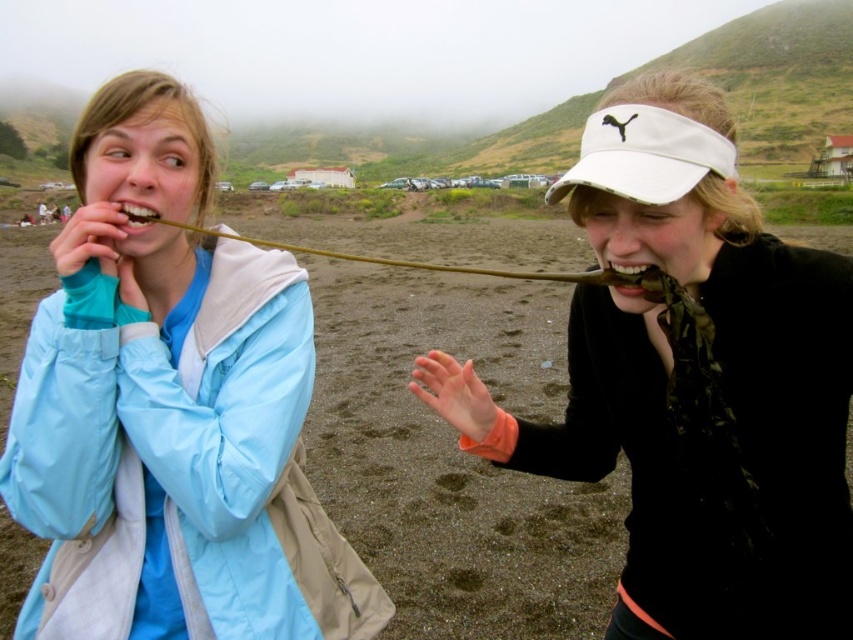
You are standing in the open area where the matte blue jacket at left and the white matte visor at center are present. If you look down from your current position, which object would you see first?

The white matte visor at center is located below the matte blue jacket at left, so when looking down, you would see the white matte visor at center first.

You are standing at the origin point in the image. Which direction should you move to reach the matte blue jacket at left?

To reach the matte blue jacket at left, you should move towards the left since its 2D location is at point 0.641 on the x axis and 0.200 on the y axis.